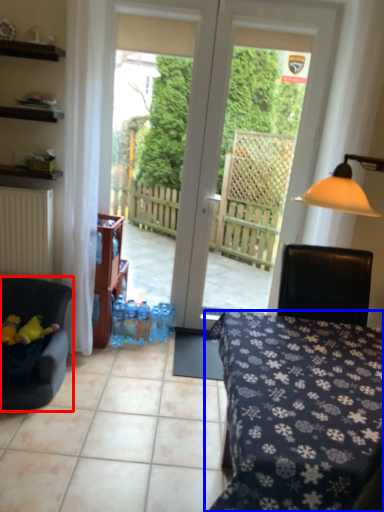
Question: Which of the following is the closest to the observer, chair (highlighted by a red box) or desk (highlighted by a blue box)?

Choices:
 (A) chair
 (B) desk

Answer: (B)